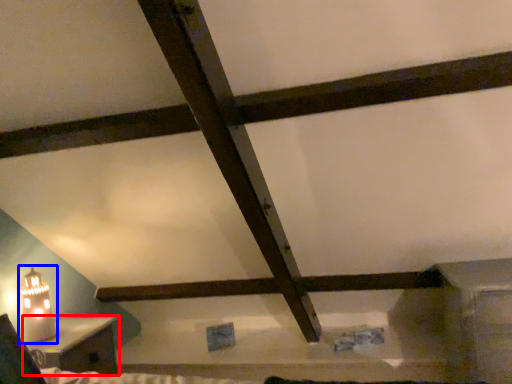
Question: Which object is closer to the camera taking this photo, furniture (highlighted by a red box) or table lamp (highlighted by a blue box)?

Choices:
 (A) furniture
 (B) table lamp

Answer: (A)